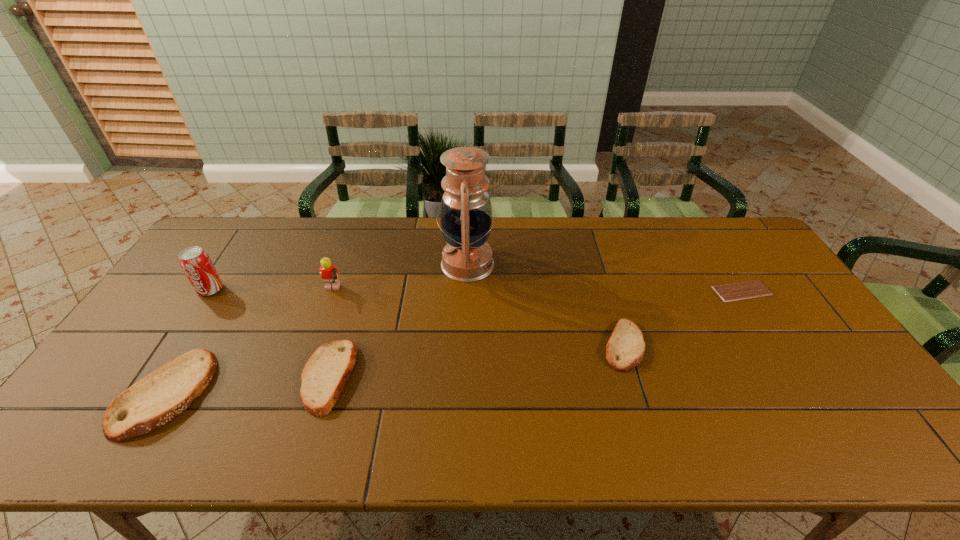
Locate an element on the screen. This screenshot has height=540, width=960. pita bread situated at the left edge is located at coordinates (163, 394).

The width and height of the screenshot is (960, 540). I want to click on soda can that is at the left edge, so click(x=195, y=262).

You are a GUI agent. You are given a task and a screenshot of the screen. Output one action in this format:
    pyautogui.click(x=<x>, y=<y>)
    Task: Click on the object at the right edge
    The image size is (960, 540).
    Given the screenshot: What is the action you would take?
    pyautogui.click(x=751, y=289)

Image resolution: width=960 pixels, height=540 pixels. Identify the location of object located at the near left corner. (163, 394).

Where is `blank space at the far edge of the desktop`? The width and height of the screenshot is (960, 540). blank space at the far edge of the desktop is located at coordinates (x=705, y=254).

The width and height of the screenshot is (960, 540). What are the coordinates of `vacant region at the near edge` in the screenshot? It's located at (619, 388).

The image size is (960, 540). What are the coordinates of `vacant area at the left edge of the desktop` in the screenshot? It's located at (162, 321).

At what (x,y) coordinates should I click in order to perform the action: click on vacant point at the right edge. Please return your answer as a coordinate pair (x, y). The image size is (960, 540). Looking at the image, I should click on (769, 322).

Locate an element on the screen. unoccupied area between the fourth shortest object and the oil lamp is located at coordinates (317, 329).

You are a GUI agent. You are given a task and a screenshot of the screen. Output one action in this format:
    pyautogui.click(x=<x>, y=<y>)
    Task: Click on the vacant region between the soda can and the rightmost object
    
    Given the screenshot: What is the action you would take?
    pyautogui.click(x=476, y=291)